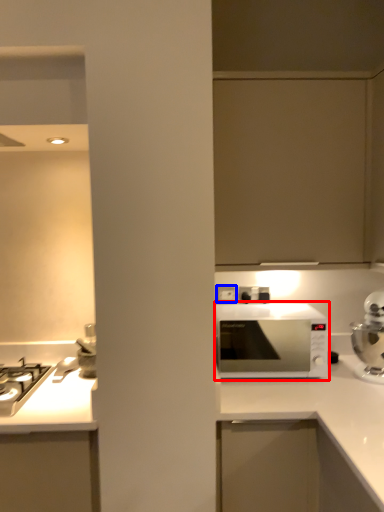
Question: Which of the following is the closest to the observer, microwave oven (highlighted by a red box) or electric outlet (highlighted by a blue box)?

Choices:
 (A) microwave oven
 (B) electric outlet

Answer: (A)